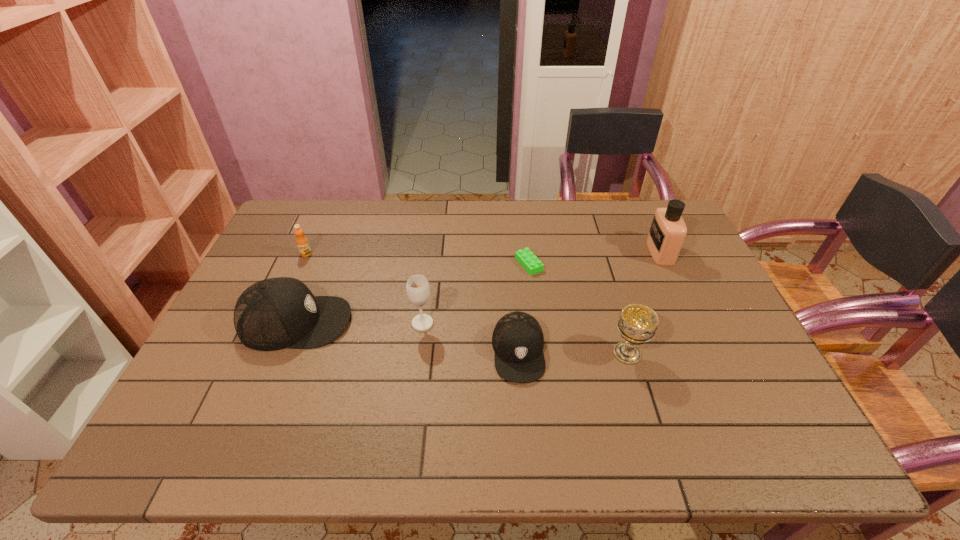
At what (x,y) coordinates should I click in order to perform the action: click on free spot that satisfies the following two spatial constraints: 1. on the front label of the perfume; 2. on the front-facing side of the shorter cap. Please return your answer as a coordinate pair (x, y). The image size is (960, 540). Looking at the image, I should click on (707, 352).

Identify the location of free point that satisfies the following two spatial constraints: 1. on the front side of the shortest object; 2. on the front-facing side of the taller cap. This screenshot has height=540, width=960. (536, 322).

You are a GUI agent. You are given a task and a screenshot of the screen. Output one action in this format:
    pyautogui.click(x=<x>, y=<y>)
    Task: Click on the vacant space that satisfies the following two spatial constraints: 1. on the front label of the orange juice; 2. on the left side of the chalice
    This screenshot has height=540, width=960.
    Given the screenshot: What is the action you would take?
    click(x=262, y=353)

The image size is (960, 540). What are the coordinates of `free spot that satisfies the following two spatial constraints: 1. on the front label of the chalice; 2. on the right side of the orange juice` in the screenshot? It's located at (262, 353).